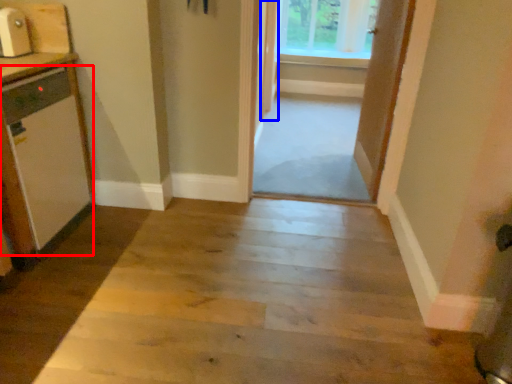
Question: Which point is closer to the camera, appliance (highlighted by a red box) or door (highlighted by a blue box)?

Choices:
 (A) appliance
 (B) door

Answer: (A)